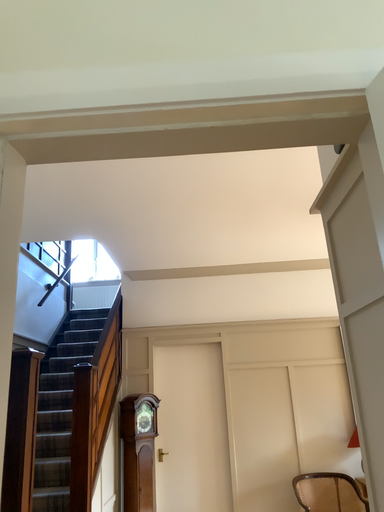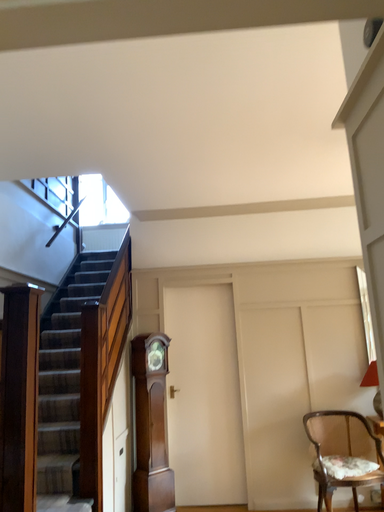
Question: Which way did the camera rotate in the video?

Choices:
 (A) rotated upward
 (B) rotated downward

Answer: (B)